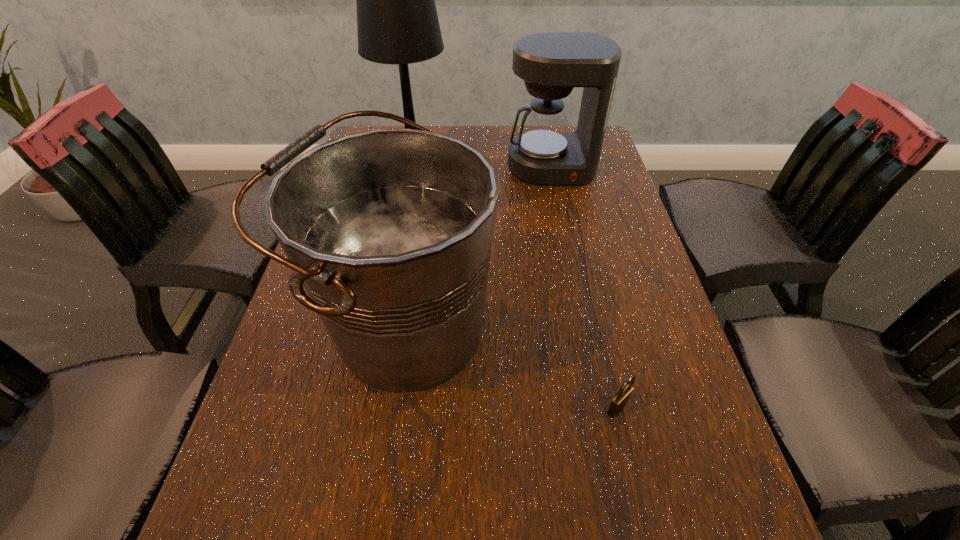
You are a GUI agent. You are given a task and a screenshot of the screen. Output one action in this format:
    pyautogui.click(x=<x>, y=<y>)
    Task: Click on the table lamp situated at the left edge
    
    Given the screenshot: What is the action you would take?
    click(x=397, y=23)

You are a GUI agent. You are given a task and a screenshot of the screen. Output one action in this format:
    pyautogui.click(x=<x>, y=<y>)
    Task: Click on the bucket that is at the left edge
    
    Given the screenshot: What is the action you would take?
    pyautogui.click(x=390, y=231)

The width and height of the screenshot is (960, 540). I want to click on coffee maker positioned at the right edge, so click(x=551, y=64).

Locate an element on the screen. This screenshot has height=540, width=960. padlock positioned at the right edge is located at coordinates (620, 400).

The image size is (960, 540). I want to click on object positioned at the far left corner, so click(x=397, y=23).

Locate an element on the screen. The image size is (960, 540). object present at the far right corner is located at coordinates (551, 64).

Identify the location of vacant area at the left edge of the desktop. (314, 332).

Find the location of a particular element. The image size is (960, 540). vacant region at the right edge of the desktop is located at coordinates (599, 288).

The height and width of the screenshot is (540, 960). I want to click on unoccupied position between the shortest object and the tallest object, so click(x=516, y=288).

This screenshot has height=540, width=960. In order to click on free point between the coffee maker and the shortest object in this screenshot , I will do `click(585, 288)`.